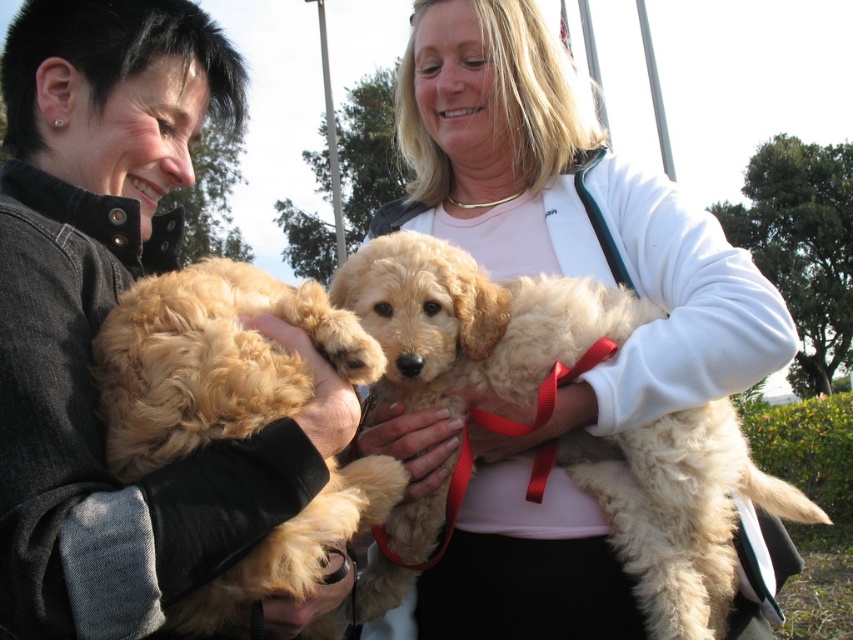
Question: Among these objects, which one is farthest from the camera?

Choices:
 (A) golden fur puppy at left
 (B) fluffy beige puppy at center

Answer: (B)

Question: Does fluffy beige puppy at center appear on the left side of golden fur puppy at left?

Choices:
 (A) no
 (B) yes

Answer: (A)

Question: Which of these objects is positioned closest to the fluffy golden fur at left?

Choices:
 (A) fluffy beige puppy at center
 (B) golden fur puppy at left

Answer: (B)

Question: Which of the following is the closest to the observer?

Choices:
 (A) fluffy golden fur at left
 (B) golden fur puppy at left

Answer: (A)

Question: Does fluffy beige puppy at center have a smaller size compared to golden fur puppy at left?

Choices:
 (A) no
 (B) yes

Answer: (A)

Question: Does fluffy golden fur at left appear on the left side of fluffy beige puppy at center?

Choices:
 (A) yes
 (B) no

Answer: (A)